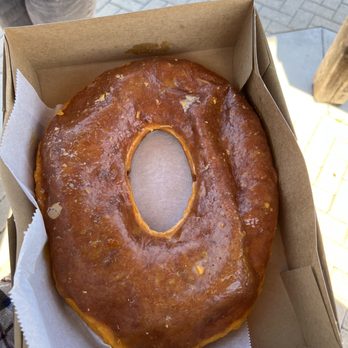
Locate an element on the screen. The height and width of the screenshot is (348, 348). beige tile is located at coordinates (297, 20).